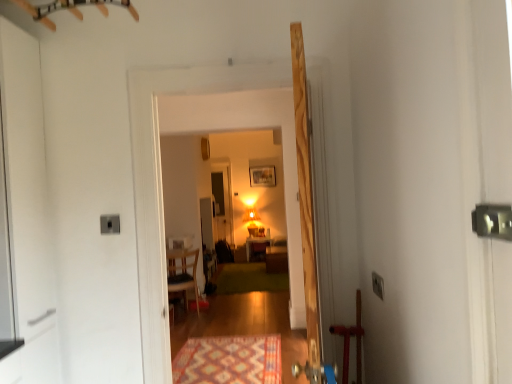
In order to click on vacant area on top of wooden floor at center (from a real-world perspective) in this screenshot , I will do `click(219, 63)`.